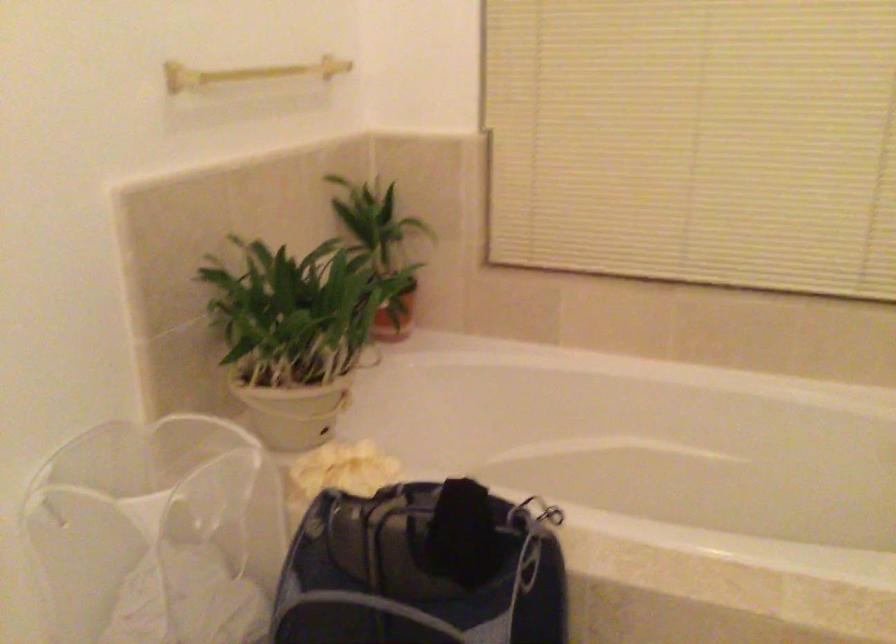
The height and width of the screenshot is (644, 896). What do you see at coordinates (157, 534) in the screenshot?
I see `the white laundry basket` at bounding box center [157, 534].